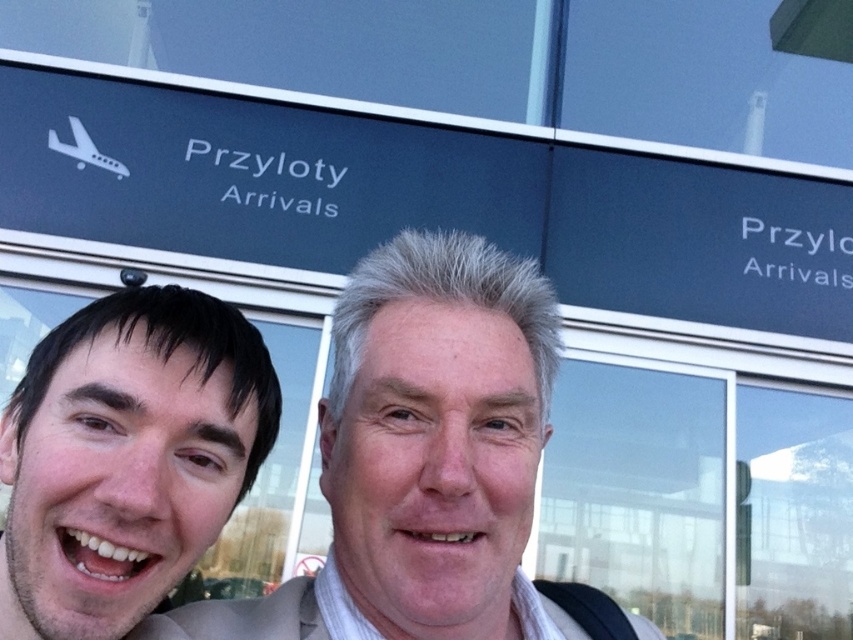
Question: Observing the image, what is the correct spatial positioning of smooth skin face at center in reference to smooth skin face at left?

Choices:
 (A) right
 (B) left

Answer: (A)

Question: Can you confirm if smooth skin face at center is positioned to the right of smooth skin face at left?

Choices:
 (A) no
 (B) yes

Answer: (B)

Question: Which of the following is the closest to the observer?

Choices:
 (A) smooth skin face at center
 (B) smooth skin face at left

Answer: (B)

Question: Which of the following is the closest to the observer?

Choices:
 (A) (6, 595)
 (B) (445, 596)

Answer: (B)

Question: Considering the relative positions of smooth skin face at center and smooth skin face at left in the image provided, where is smooth skin face at center located with respect to smooth skin face at left?

Choices:
 (A) left
 (B) right

Answer: (B)